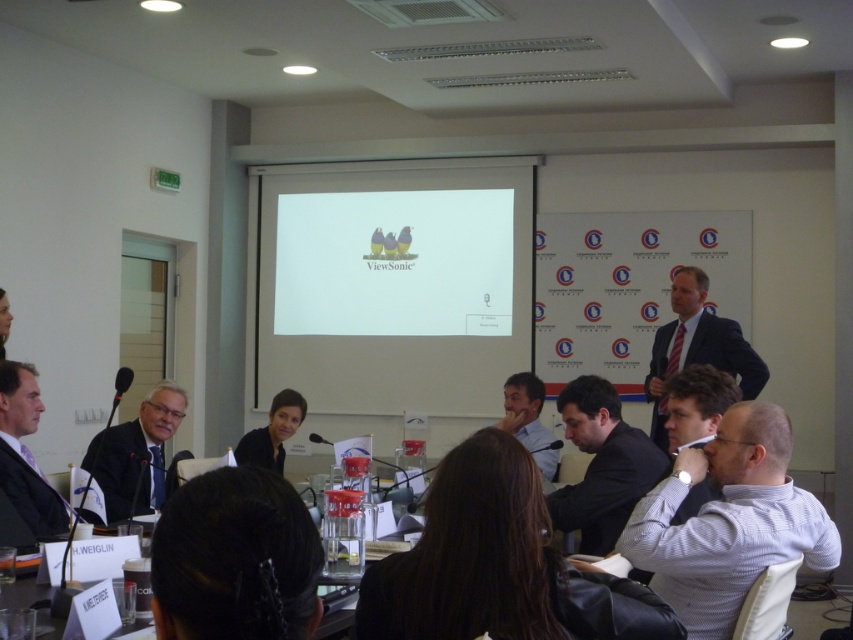
Between white striped shirt at lower right and light brown suit at center, which one appears on the right side from the viewer's perspective?

From the viewer's perspective, white striped shirt at lower right appears more on the right side.

I want to click on white striped shirt at lower right, so click(x=728, y=522).

Can you confirm if dark suit at left is wider than light brown suit at center?

Yes, dark suit at left is wider than light brown suit at center.

Can you confirm if dark suit at left is positioned to the left of light brown suit at center?

Yes, dark suit at left is to the left of light brown suit at center.

Measure the distance between dark suit at left and camera.

dark suit at left and camera are 2.84 meters apart from each other.

The image size is (853, 640). In order to click on dark suit at left in this screenshot , I will do `click(25, 452)`.

Is point (608, 460) farther from viewer compared to point (10, 461)?

No.

Which of these two, dark suit at center or dark suit at left, stands shorter?

dark suit at left

Image resolution: width=853 pixels, height=640 pixels. Describe the element at coordinates (602, 465) in the screenshot. I see `dark suit at center` at that location.

What are the coordinates of `dark suit at center` in the screenshot? It's located at (602, 465).